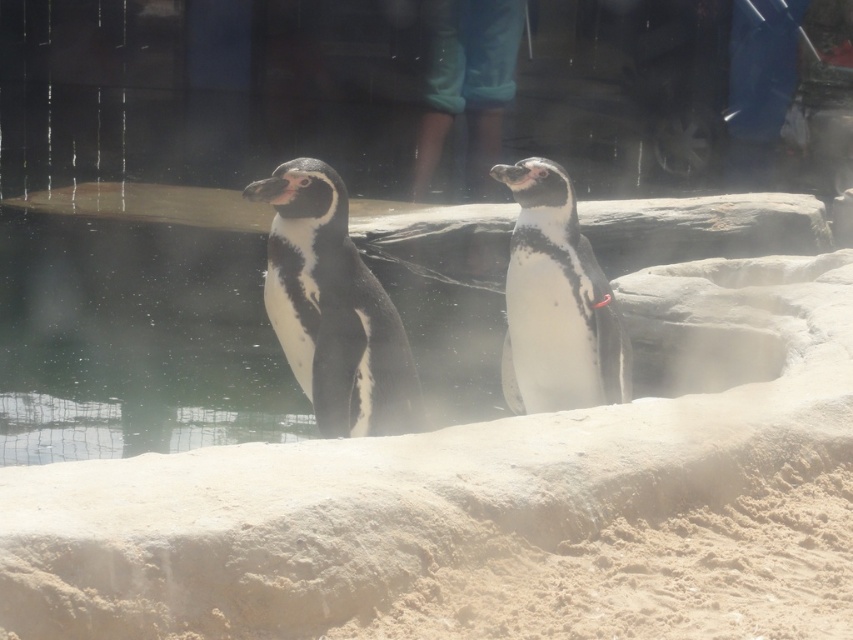
Question: Does black matte penguin at center appear over white matte penguin at center?

Choices:
 (A) no
 (B) yes

Answer: (A)

Question: Does white matte penguin at center appear on the left side of smooth fabric pants at upper center?

Choices:
 (A) no
 (B) yes

Answer: (A)

Question: Which of the following is the closest to the observer?

Choices:
 (A) smooth fabric pants at upper center
 (B) white matte penguin at center
 (C) black matte penguin at center

Answer: (C)

Question: Among these objects, which one is nearest to the camera?

Choices:
 (A) smooth fabric pants at upper center
 (B) white matte penguin at center

Answer: (B)

Question: Can you confirm if black matte penguin at center is positioned below smooth fabric pants at upper center?

Choices:
 (A) yes
 (B) no

Answer: (A)

Question: Which point is closer to the camera?

Choices:
 (A) white matte penguin at center
 (B) smooth fabric pants at upper center

Answer: (A)